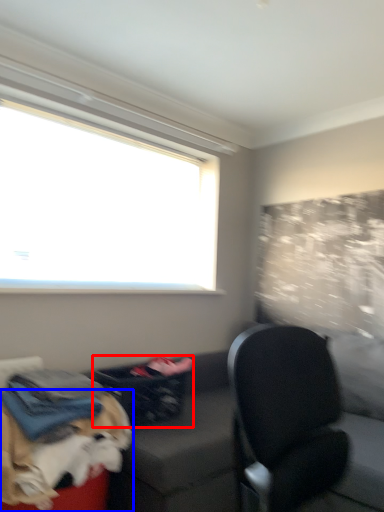
Question: Which point is further to the camera, laundry basket (highlighted by a red box) or dog (highlighted by a blue box)?

Choices:
 (A) laundry basket
 (B) dog

Answer: (A)